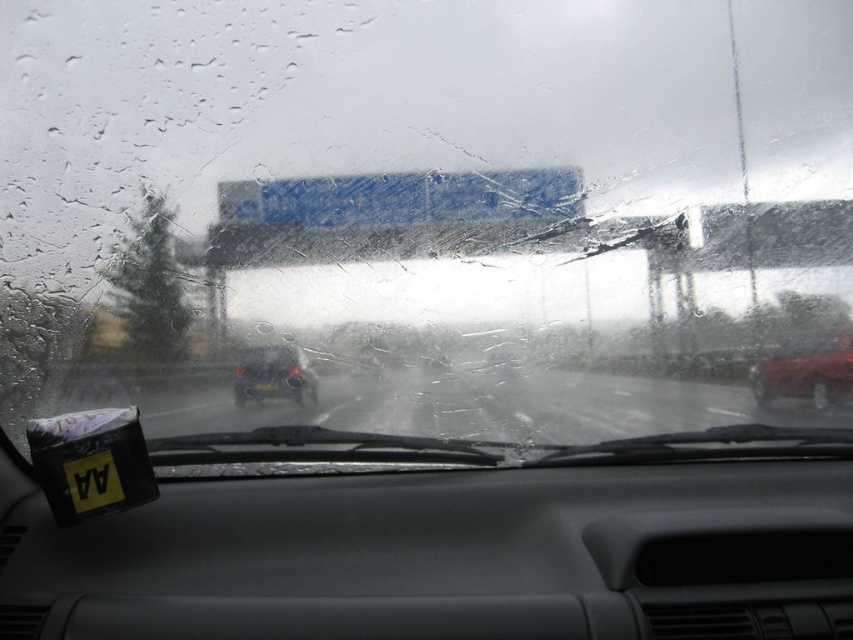
Question: Can you confirm if transparent wet glass at center is thinner than shiny red sedan at right?

Choices:
 (A) yes
 (B) no

Answer: (B)

Question: Is transparent wet glass at center to the left of black plastic license plate at center from the viewer's perspective?

Choices:
 (A) no
 (B) yes

Answer: (A)

Question: Is transparent wet glass at center further to the viewer compared to matte black car at center?

Choices:
 (A) yes
 (B) no

Answer: (B)

Question: Which of the following is the farthest from the observer?

Choices:
 (A) black matte license plate at lower left
 (B) black plastic license plate at center
 (C) matte black car at center

Answer: (B)

Question: Which point is closer to the camera?

Choices:
 (A) (138, 188)
 (B) (258, 387)
 (C) (84, 486)

Answer: (C)

Question: Estimate the real-world distances between objects in this image. Which object is closer to the matte black car at center?

Choices:
 (A) black matte license plate at lower left
 (B) transparent wet glass at center
 (C) shiny red sedan at right
 (D) black plastic license plate at center

Answer: (D)